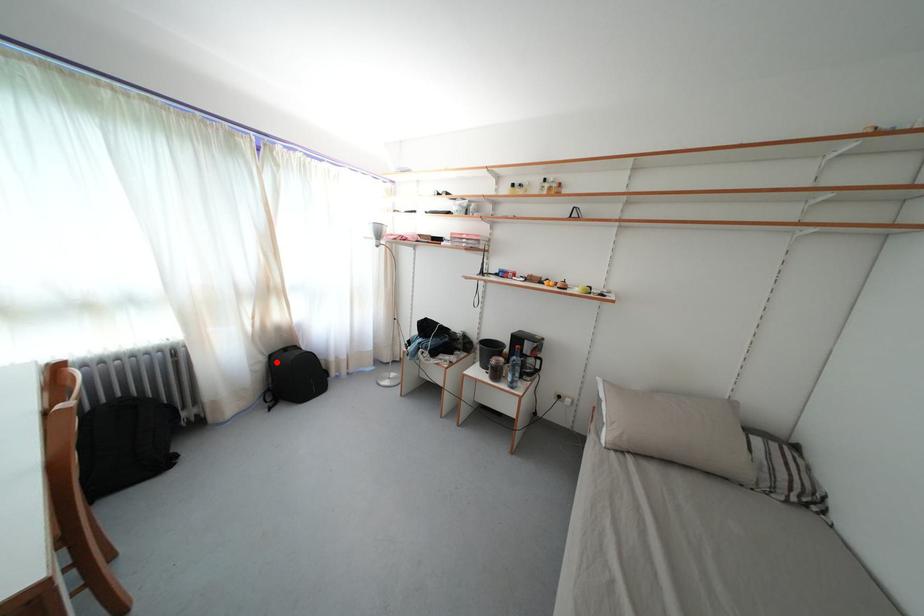
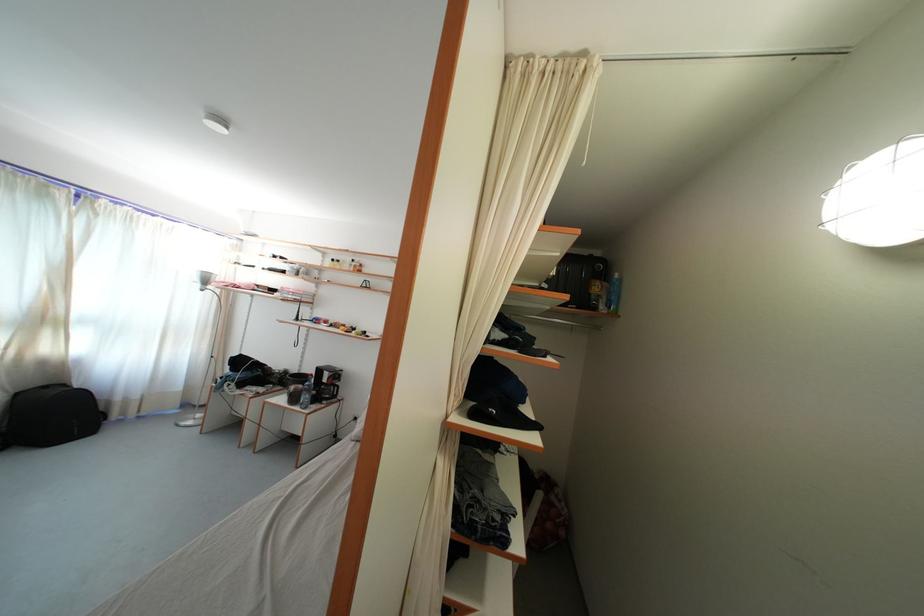
Locate, in the second image, the point that corresponds to the highlighted location in the first image.

(23, 400)